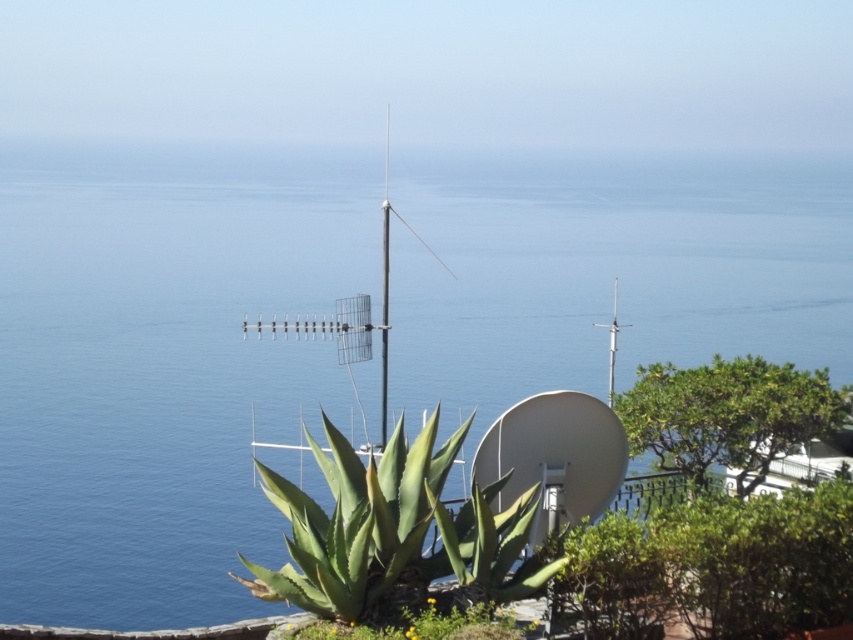
The image size is (853, 640). What do you see at coordinates (395, 529) in the screenshot? I see `green leafy plant at center` at bounding box center [395, 529].

Is green leafy plant at center bigger than green leafy bush at right?

Correct, green leafy plant at center is larger in size than green leafy bush at right.

Is point (428, 445) more distant than point (637, 378)?

No, (428, 445) is in front of (637, 378).

Where is `green leafy plant at center`? Image resolution: width=853 pixels, height=640 pixels. green leafy plant at center is located at coordinates (395, 529).

Between point (682, 424) and point (618, 280), which one is positioned in front?

Point (682, 424) is in front.

Can you confirm if green leafy bush at right is positioned to the right of metallic silver antenna at center?

No, green leafy bush at right is not to the right of metallic silver antenna at center.

Which is behind, point (724, 444) or point (613, 312)?

The point (613, 312) is behind.

This screenshot has width=853, height=640. In order to click on green leafy bush at right in this screenshot , I will do `click(726, 416)`.

Locate an element on the screen. The image size is (853, 640). green leafy bush at lower right is located at coordinates (717, 566).

Who is shorter, green leafy bush at lower right or green leafy bush at right?

With less height is green leafy bush at lower right.

Does point (780, 625) lie in front of point (787, 403)?

That is True.

Find the location of a particular element. The width and height of the screenshot is (853, 640). green leafy bush at lower right is located at coordinates (717, 566).